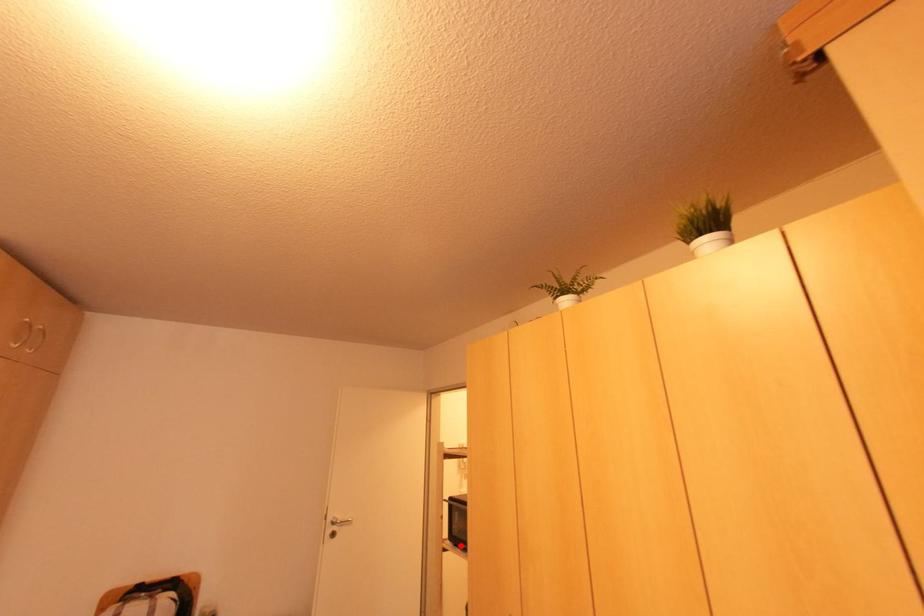
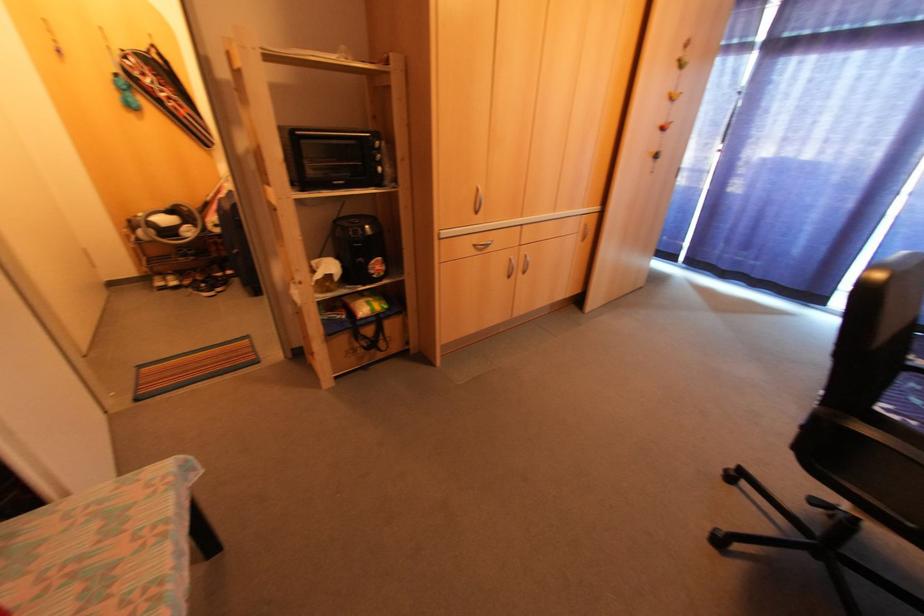
Locate, in the second image, the point that corresponds to the highlighted location in the first image.

(334, 184)